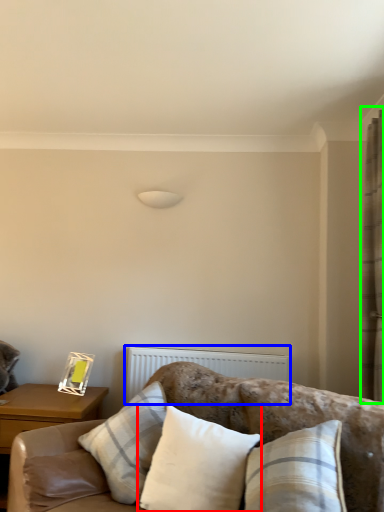
Question: Which object is the farthest from pillow (highlighted by a red box)? Choose among these: radiator (highlighted by a blue box) or curtain (highlighted by a green box).

Choices:
 (A) radiator
 (B) curtain

Answer: (B)